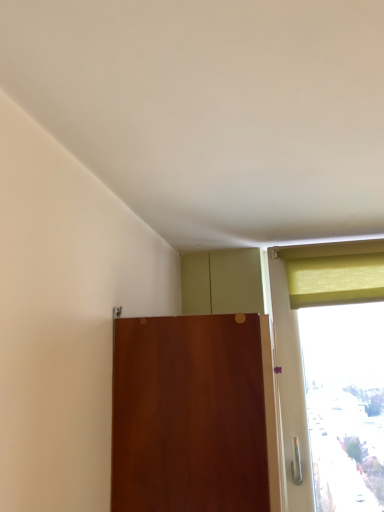
Question: Does point (369, 265) appear closer or farther from the camera than point (238, 444)?

Choices:
 (A) farther
 (B) closer

Answer: (A)

Question: Choose the correct answer: Is matte yellow curtain at upper right inside matte wood door at center or outside it?

Choices:
 (A) inside
 (B) outside

Answer: (B)

Question: Is matte yellow curtain at upper right taller or shorter than matte wood door at center?

Choices:
 (A) tall
 (B) short

Answer: (B)

Question: From the image's perspective, relative to matte yellow curtain at upper right, is matte wood door at center above or below?

Choices:
 (A) below
 (B) above

Answer: (A)

Question: Considering their positions, is matte wood door at center located in front of or behind matte yellow curtain at upper right?

Choices:
 (A) front
 (B) behind

Answer: (A)

Question: Considering the positions of matte wood door at center and matte yellow curtain at upper right in the image, is matte wood door at center wider or thinner than matte yellow curtain at upper right?

Choices:
 (A) wide
 (B) thin

Answer: (A)

Question: Is matte wood door at center to the left or to the right of matte yellow curtain at upper right in the image?

Choices:
 (A) left
 (B) right

Answer: (A)